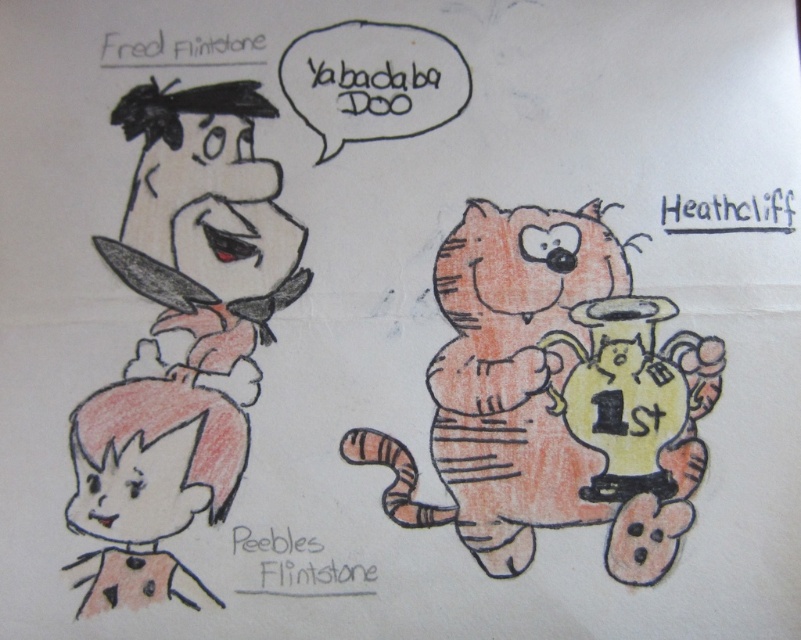
In the hand drawn illustration of The Flintstones characters, there is an orange striped cat at right and a matte pink hair at lower left. Which object is nearer to you, the viewer?

The orange striped cat at right is closer to the viewer than the matte pink hair at lower left.